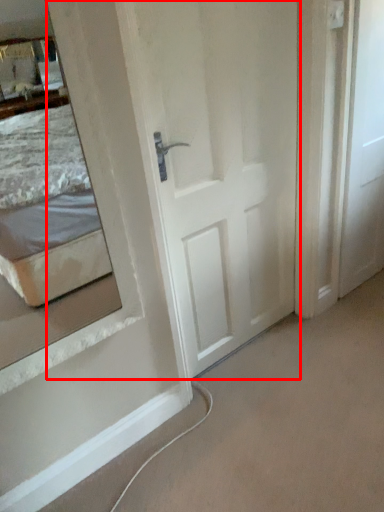
Question: From the image's perspective, considering the relative positions of door (annotated by the red box) and door in the image provided, where is door (annotated by the red box) located with respect to the staircase?

Choices:
 (A) above
 (B) below

Answer: (B)